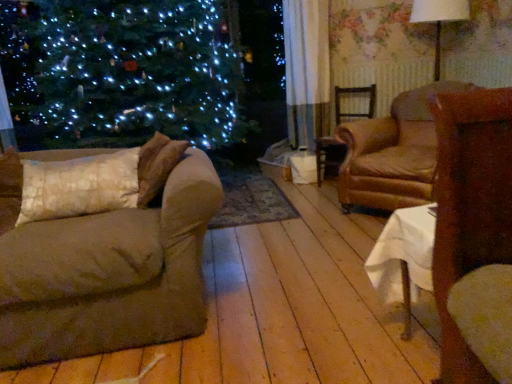
This screenshot has height=384, width=512. Describe the element at coordinates (79, 186) in the screenshot. I see `white textured pillow at left` at that location.

Measure the distance between point (433,18) and camera.

10.31 feet.

This screenshot has height=384, width=512. What do you see at coordinates (439, 19) in the screenshot?
I see `white fabric lampshade at upper right` at bounding box center [439, 19].

Where is `brown wooden chair at center, the first chair in the back-to-front sequence`? This screenshot has height=384, width=512. brown wooden chair at center, the first chair in the back-to-front sequence is located at coordinates (355, 93).

In order to click on brown leather armchair at center-right, which is the 1th chair from front to back in this screenshot , I will do `click(392, 153)`.

Which object is more forward, brown leather armchair at center-right, which is the 1th chair from front to back, or white textured pillow at left?

white textured pillow at left is closer to the camera.

Consider the image. Is white textured pillow at left inside brown leather armchair at center-right, which is the 1th chair from front to back?

No, white textured pillow at left is not a part of brown leather armchair at center-right, which is the 1th chair from front to back.

From the image's perspective, who appears lower, brown leather armchair at center-right, which is the 1th chair from front to back, or white textured pillow at left?

white textured pillow at left appears lower in the image.

Does brown leather armchair at center-right, which ranks as the 2th chair in back-to-front order, appear on the right side of white textured pillow at left?

Correct, you'll find brown leather armchair at center-right, which ranks as the 2th chair in back-to-front order, to the right of white textured pillow at left.

From a real-world perspective, is brown leather armchair at center-right, which is the 1th chair from front to back, beneath brown fabric couch at left?

Incorrect, from a real-world perspective, brown leather armchair at center-right, which is the 1th chair from front to back, is higher than brown fabric couch at left.

How different are the orientations of brown leather armchair at center-right, which ranks as the 2th chair in back-to-front order, and brown fabric couch at left in degrees?

54.3 degrees.

Is brown leather armchair at center-right, which ranks as the 2th chair in back-to-front order, outside of brown fabric couch at left?

brown leather armchair at center-right, which ranks as the 2th chair in back-to-front order, is positioned outside brown fabric couch at left.

Who is shorter, brown leather armchair at center-right, which ranks as the 2th chair in back-to-front order, or brown fabric couch at left?

With less height is brown fabric couch at left.

Consider the image. Is brown wooden chair at center, the first chair in the back-to-front sequence, thinner than brown fabric couch at left?

Yes, brown wooden chair at center, the first chair in the back-to-front sequence, is thinner than brown fabric couch at left.

Is brown wooden chair at center, positioned as the 2th chair in front-to-back order, spatially inside brown fabric couch at left, or outside of it?

brown wooden chair at center, positioned as the 2th chair in front-to-back order, is spatially situated outside brown fabric couch at left.

From a real-world perspective, which is physically above, brown wooden chair at center, positioned as the 2th chair in front-to-back order, or brown fabric couch at left?

brown wooden chair at center, positioned as the 2th chair in front-to-back order, from a real-world perspective.

Which of these two, brown wooden chair at center, the first chair in the back-to-front sequence, or brown fabric couch at left, is bigger?

Bigger between the two is brown fabric couch at left.

Which of these two, brown leather armchair at center-right, which ranks as the 2th chair in back-to-front order, or white fabric lampshade at upper right, is wider?

With larger width is brown leather armchair at center-right, which ranks as the 2th chair in back-to-front order.

Is brown leather armchair at center-right, which is the 1th chair from front to back, spatially inside white fabric lampshade at upper right, or outside of it?

brown leather armchair at center-right, which is the 1th chair from front to back, is not inside white fabric lampshade at upper right, it's outside.

From a real-world perspective, which object stands above the other?

white fabric lampshade at upper right, from a real-world perspective.

Does white textured pillow at left have a smaller size compared to white fabric lampshade at upper right?

Yes.

From the image's perspective, is white textured pillow at left beneath white fabric lampshade at upper right?

Indeed, from the image's perspective, white textured pillow at left is shown beneath white fabric lampshade at upper right.

Is point (125, 205) farther from camera compared to point (465, 15)?

No.

From the picture: Measure the distance between white textured pillow at left and white fabric lampshade at upper right.

white textured pillow at left is 2.59 meters from white fabric lampshade at upper right.

Between white textured pillow at left and brown leather armchair at center-right, which is the 1th chair from front to back, which one appears on the right side from the viewer's perspective?

Positioned to the right is brown leather armchair at center-right, which is the 1th chair from front to back.

Is white textured pillow at left closer to the viewer compared to brown leather armchair at center-right, which is the 1th chair from front to back?

Yes, white textured pillow at left is closer to the camera.

From the image's perspective, is white textured pillow at left on brown leather armchair at center-right, which ranks as the 2th chair in back-to-front order?

No, from the image's perspective, white textured pillow at left is not on top of brown leather armchair at center-right, which ranks as the 2th chair in back-to-front order.

Looking at this image, is brown fabric couch at left in front of or behind brown wooden chair at center, positioned as the 2th chair in front-to-back order, in the image?

brown fabric couch at left is positioned closer to the viewer than brown wooden chair at center, positioned as the 2th chair in front-to-back order.

Considering the relative sizes of brown fabric couch at left and brown wooden chair at center, positioned as the 2th chair in front-to-back order, in the image provided, is brown fabric couch at left wider than brown wooden chair at center, positioned as the 2th chair in front-to-back order,?

Yes.

Consider the image. Considering the sizes of objects brown fabric couch at left and brown wooden chair at center, the first chair in the back-to-front sequence, in the image provided, who is taller, brown fabric couch at left or brown wooden chair at center, the first chair in the back-to-front sequence,?

With more height is brown wooden chair at center, the first chair in the back-to-front sequence.

This screenshot has height=384, width=512. I want to click on chair that is the 2nd one when counting rightward from the white textured pillow at left, so click(392, 153).

Where is `studio couch below the brown leather armchair at center-right, which is the 1th chair from front to back (from the image's perspective)`? The height and width of the screenshot is (384, 512). studio couch below the brown leather armchair at center-right, which is the 1th chair from front to back (from the image's perspective) is located at coordinates (104, 268).

Which object lies further to the anchor point brown wooden chair at center, the first chair in the back-to-front sequence, brown leather armchair at center-right, which ranks as the 2th chair in back-to-front order, or white textured pillow at left?

white textured pillow at left.

Which object lies nearer to the anchor point brown leather armchair at center-right, which is the 1th chair from front to back, brown fabric couch at left or brown wooden chair at center, positioned as the 2th chair in front-to-back order?

brown wooden chair at center, positioned as the 2th chair in front-to-back order.

Based on their spatial positions, is white textured pillow at left or brown leather armchair at center-right, which is the 1th chair from front to back, closer to brown wooden chair at center, the first chair in the back-to-front sequence?

brown leather armchair at center-right, which is the 1th chair from front to back, is closer to brown wooden chair at center, the first chair in the back-to-front sequence.

Estimate the real-world distances between objects in this image. Which object is further from brown leather armchair at center-right, which ranks as the 2th chair in back-to-front order, white fabric lampshade at upper right or brown fabric couch at left?

brown fabric couch at left is further to brown leather armchair at center-right, which ranks as the 2th chair in back-to-front order.

Based on their spatial positions, is white fabric lampshade at upper right or white textured pillow at left further from brown wooden chair at center, positioned as the 2th chair in front-to-back order?

Based on the image, white textured pillow at left appears to be further to brown wooden chair at center, positioned as the 2th chair in front-to-back order.

Considering their positions, is white textured pillow at left positioned closer to brown fabric couch at left than brown leather armchair at center-right, which ranks as the 2th chair in back-to-front order?

Among the two, white textured pillow at left is located nearer to brown fabric couch at left.

Based on their spatial positions, is white fabric lampshade at upper right or brown fabric couch at left further from brown wooden chair at center, positioned as the 2th chair in front-to-back order?

brown fabric couch at left.

When comparing their distances from brown wooden chair at center, positioned as the 2th chair in front-to-back order, does white textured pillow at left or white fabric lampshade at upper right seem closer?

white fabric lampshade at upper right is closer to brown wooden chair at center, positioned as the 2th chair in front-to-back order.

In order to click on chair between brown fabric couch at left and brown leather armchair at center-right, which ranks as the 2th chair in back-to-front order, in the horizontal direction in this screenshot , I will do `click(355, 93)`.

This screenshot has width=512, height=384. I want to click on lamp located between brown leather armchair at center-right, which ranks as the 2th chair in back-to-front order, and brown wooden chair at center, positioned as the 2th chair in front-to-back order, in the depth direction, so click(x=439, y=19).

This screenshot has height=384, width=512. I want to click on studio couch situated between white textured pillow at left and white fabric lampshade at upper right from left to right, so click(x=104, y=268).

Identify the location of studio couch located between white textured pillow at left and brown leather armchair at center-right, which is the 1th chair from front to back, in the left-right direction. This screenshot has height=384, width=512. (104, 268).